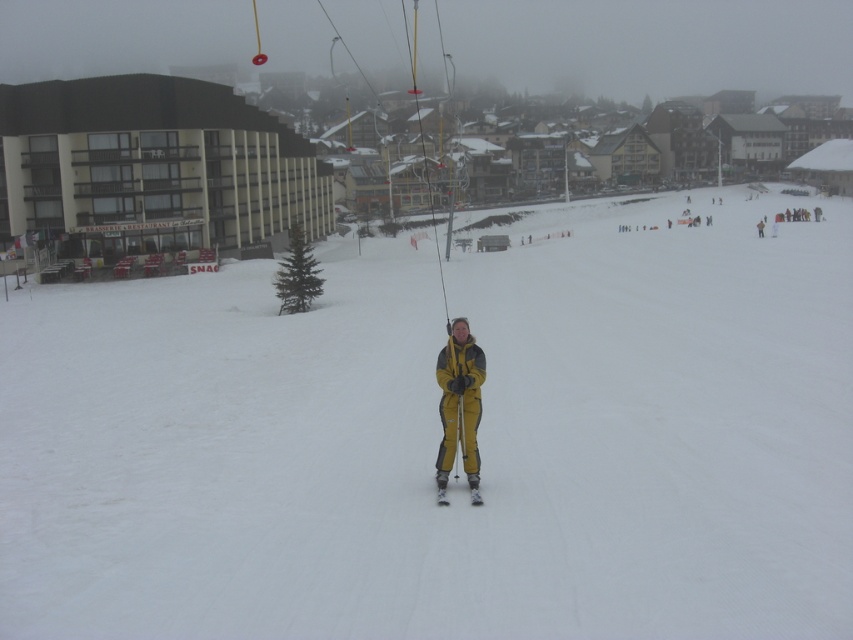
Can you confirm if beige concrete building at upper left is wider than yellow matte ski suit at center?

Indeed, beige concrete building at upper left has a greater width compared to yellow matte ski suit at center.

The image size is (853, 640). Describe the element at coordinates (154, 166) in the screenshot. I see `beige concrete building at upper left` at that location.

Find the location of a particular element. The image size is (853, 640). beige concrete building at upper left is located at coordinates (154, 166).

Can you confirm if white snow ski slope at center is positioned above yellow matte ski at center?

Indeed, white snow ski slope at center is positioned over yellow matte ski at center.

Is white snow ski slope at center closer to camera compared to yellow matte ski at center?

Yes, white snow ski slope at center is in front of yellow matte ski at center.

Who is more distant from viewer, (x=136, y=428) or (x=469, y=486)?

The point (x=136, y=428) is more distant.

Identify the location of white snow ski slope at center. This screenshot has height=640, width=853. coord(439,436).

Consider the image. Does yellow matte ski suit at center appear on the right side of yellow matte ski at center?

Incorrect, yellow matte ski suit at center is not on the right side of yellow matte ski at center.

Does yellow matte ski suit at center have a larger size compared to yellow matte ski at center?

Yes, yellow matte ski suit at center is bigger than yellow matte ski at center.

Is point (451, 340) more distant than point (445, 500)?

Yes, it is behind point (445, 500).

You are a GUI agent. You are given a task and a screenshot of the screen. Output one action in this format:
    pyautogui.click(x=<x>, y=<y>)
    Task: Click on the yellow matte ski suit at center
    
    Given the screenshot: What is the action you would take?
    [x=459, y=406]